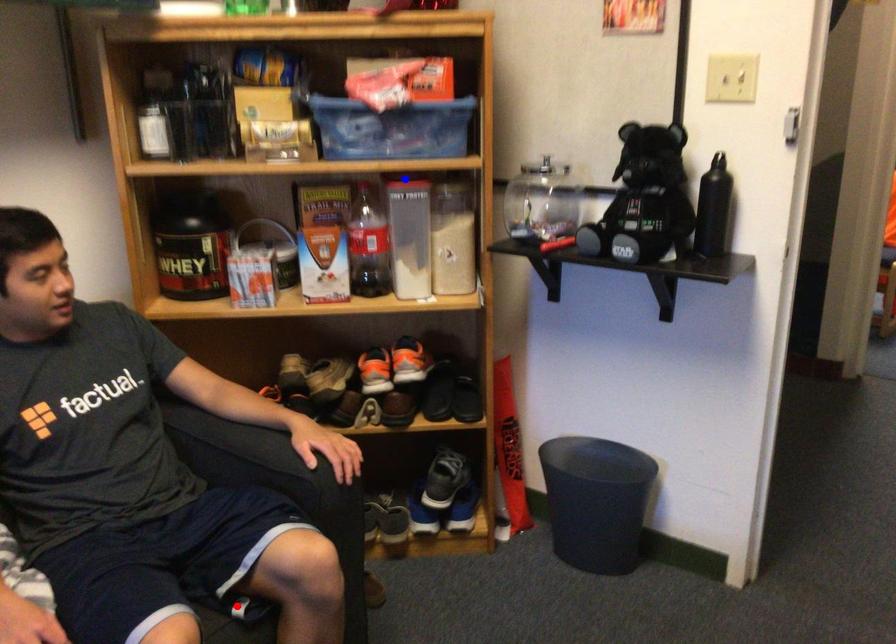
Question: Two points are marked on the image. Which point is closer to the camera?

Choices:
 (A) Blue point is closer.
 (B) Red point is closer.

Answer: (B)